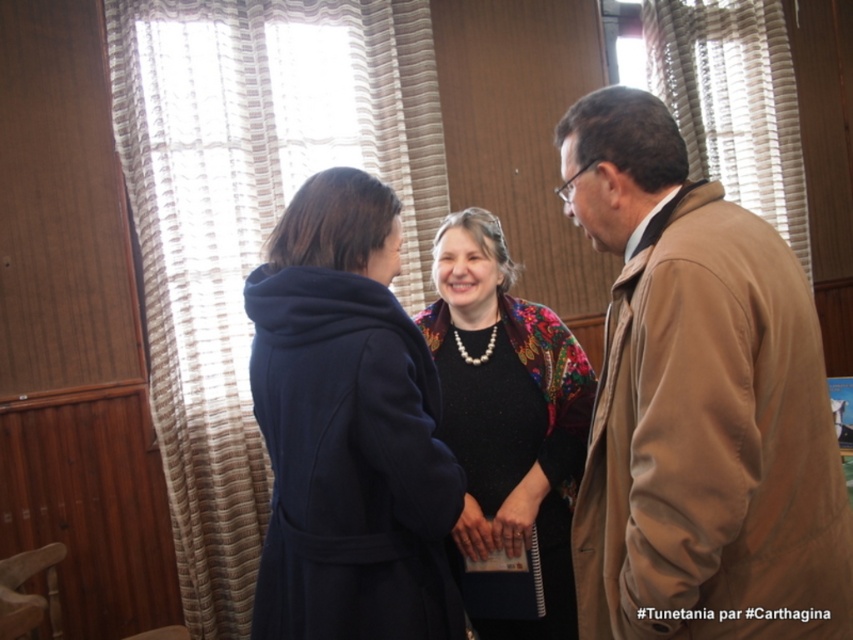
Question: Can you confirm if tan leather jacket at right is thinner than floral-patterned fabric at center?

Choices:
 (A) no
 (B) yes

Answer: (A)

Question: Is tan leather jacket at right in front of matte blue coat at center?

Choices:
 (A) no
 (B) yes

Answer: (B)

Question: Estimate the real-world distances between objects in this image. Which object is closer to the matte blue coat at center?

Choices:
 (A) tan leather jacket at right
 (B) dark blue wool coat at center
 (C) floral-patterned fabric at center

Answer: (A)

Question: Considering the real-world distances, which object is closest to the floral-patterned fabric at center?

Choices:
 (A) tan leather jacket at right
 (B) dark blue wool coat at center

Answer: (A)

Question: Is tan leather jacket at right positioned in front of dark blue wool coat at center?

Choices:
 (A) no
 (B) yes

Answer: (B)

Question: Which of the following is the closest to the observer?

Choices:
 (A) (300, 518)
 (B) (753, 561)
 (C) (682, 272)

Answer: (C)